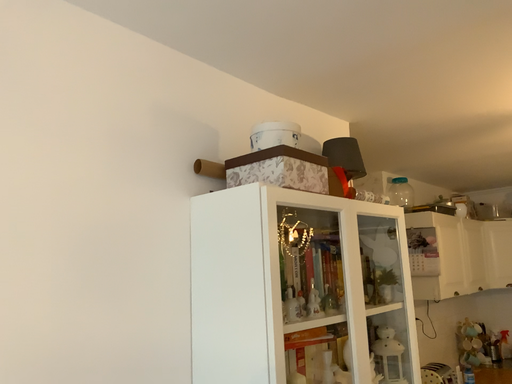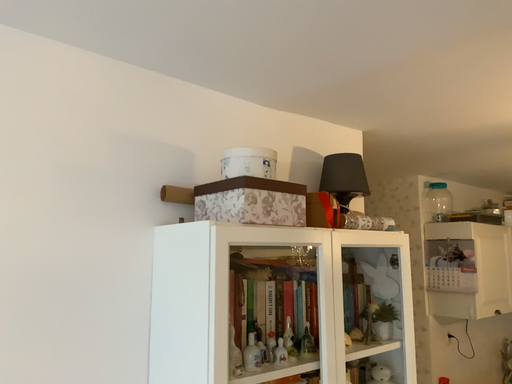
Question: Which way did the camera rotate in the video?

Choices:
 (A) rotated left
 (B) rotated right

Answer: (A)